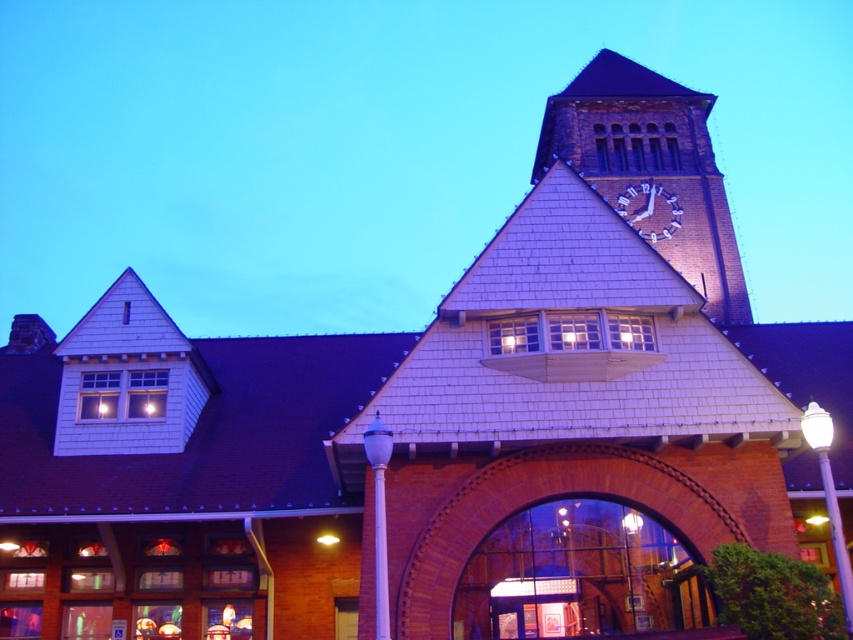
The image size is (853, 640). Describe the element at coordinates (650, 170) in the screenshot. I see `brick clock tower at upper center` at that location.

Locate an element on the screen. brick clock tower at upper center is located at coordinates (650, 170).